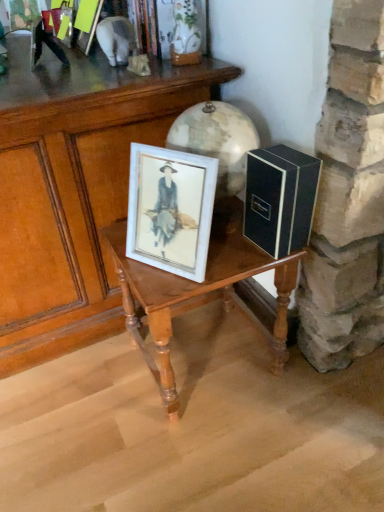
The width and height of the screenshot is (384, 512). Find the location of `free space on the front side of white matte picture frame at center`. free space on the front side of white matte picture frame at center is located at coordinates (161, 287).